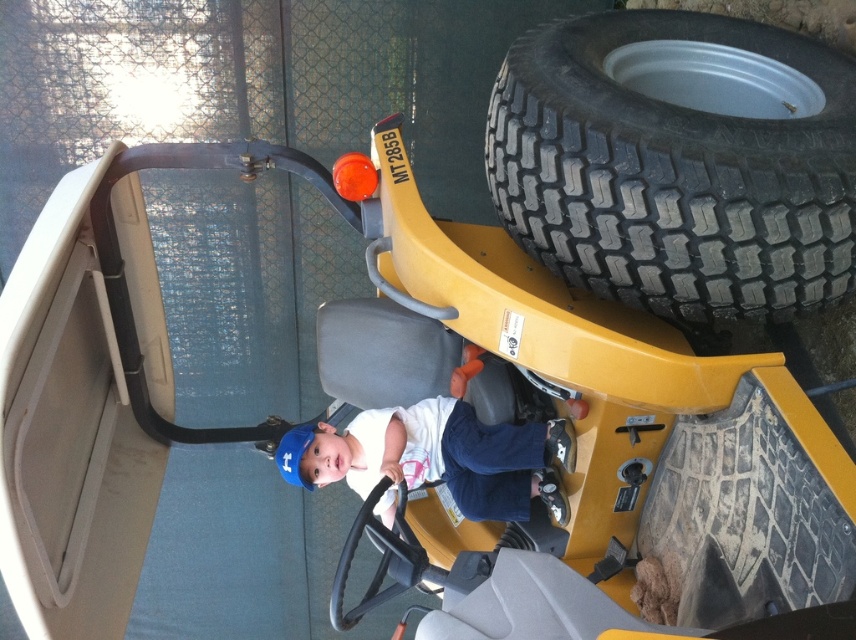
Is black rubber tire at right shorter than white fabric shirt at center?

No.

Who is more forward, (745, 282) or (287, 445)?

Point (745, 282) is more forward.

The image size is (856, 640). I want to click on black rubber tire at right, so click(x=675, y=172).